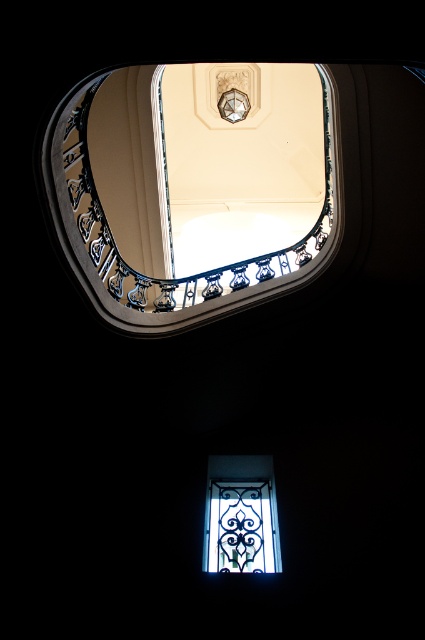
You are standing at the bottom of the staircase and want to look up through the clear glass window at lower center. Which clear glass at upper center is located to the left of it?

The clear glass at upper center is positioned on the left side of the clear glass window at lower center, so it is to the left of the clear glass window at lower center.

You are standing at the bottom of the staircase and want to look up through the clear glass window at lower center to see the decorative ceiling fixture. Can you see the clear glass at upper center from your current position?

Yes, because the clear glass at upper center is located above the clear glass window at lower center, so looking up through the clear glass window at lower center would allow you to see the clear glass at upper center above it.